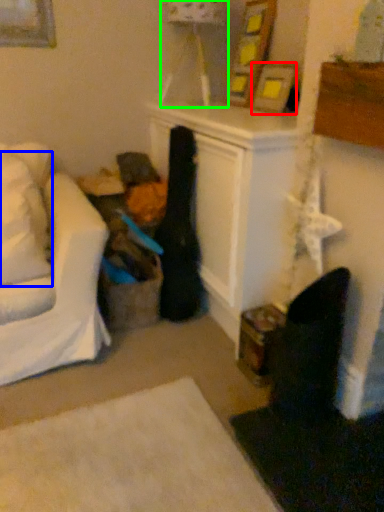
Question: Considering the real-world distances, which object is closest to picture frame (highlighted by a red box)? pillow (highlighted by a blue box) or lamp (highlighted by a green box).

Choices:
 (A) pillow
 (B) lamp

Answer: (B)